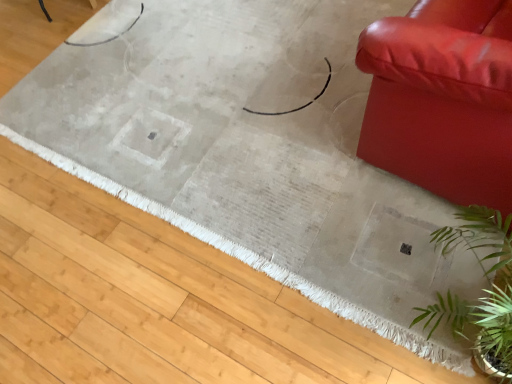
The image size is (512, 384). Identify the location of vacant location behind green leafy plant at lower right. (384, 228).